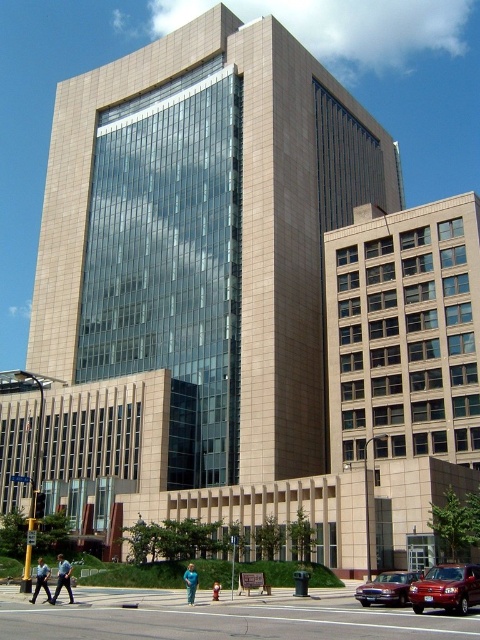
You are standing at the point marked as point (45,586) and want to take a photo of the building. The camera you are using has a maximum zoom range of 30 meters. Can the camera zoom far enough to capture the entire building in one shot?

The distance between you and the building is 34.52 meters, which exceeds the camera maximum zoom range of 30 meters. Therefore, the camera cannot zoom far enough to capture the entire building in one shot.

You are a photographer standing in front of the modern urban building. You notice two items in the foreground, the dark blue jeans at lower left and the blue fabric person at lower center. Which of these two items is wider?

The dark blue jeans at lower left is wider than the blue fabric person at lower center.